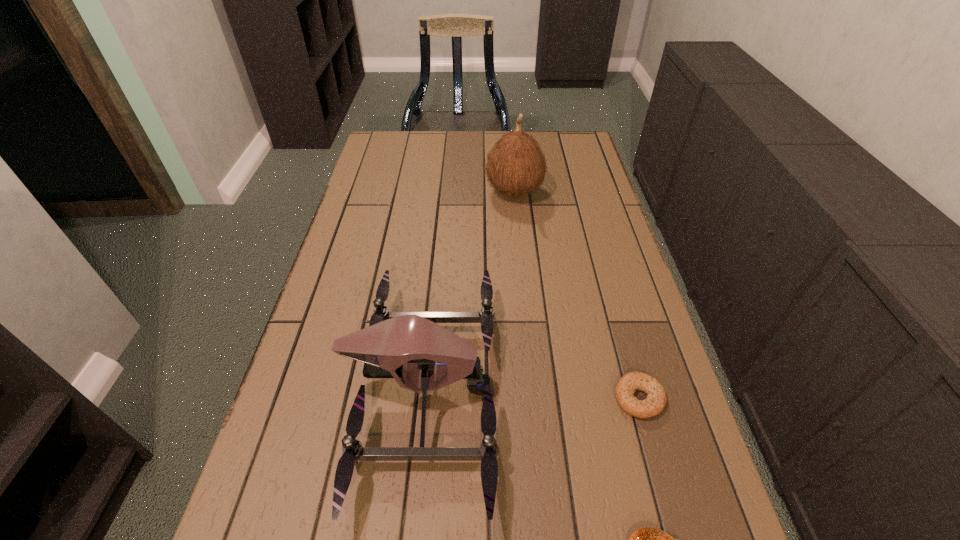
Identify which object is the third closest to the tallest object. Please provide its 2D coordinates. Your answer should be formatted as a tuple, i.e. [(x, y)], where the tuple contains the x and y coordinates of a point satisfying the conditions above.

[(646, 539)]

What are the coordinates of `object that ranks as the second closest to the shorter bagel` in the screenshot? It's located at (409, 345).

Locate an element on the screen. The height and width of the screenshot is (540, 960). free spot that satisfies the following two spatial constraints: 1. on the front-facing side of the farther bagel; 2. on the left side of the drone is located at coordinates (421, 398).

The height and width of the screenshot is (540, 960). I want to click on free spot that satisfies the following two spatial constraints: 1. on the surface of the farther bagel; 2. on the right side of the tallest object, so click(x=534, y=398).

Where is `vacant space that satisfies the following two spatial constraints: 1. on the front-facing side of the farther bagel; 2. on the right side of the third shortest object`? vacant space that satisfies the following two spatial constraints: 1. on the front-facing side of the farther bagel; 2. on the right side of the third shortest object is located at coordinates (421, 398).

At what (x,y) coordinates should I click in order to perform the action: click on vacant area in the image that satisfies the following two spatial constraints: 1. on the back side of the farther bagel; 2. on the front-facing side of the drone. Please return your answer as a coordinate pair (x, y). The width and height of the screenshot is (960, 540). Looking at the image, I should click on [636, 390].

Locate an element on the screen. vacant area in the image that satisfies the following two spatial constraints: 1. on the surface of the coconut; 2. on the left side of the farther bagel is located at coordinates (534, 398).

At what (x,y) coordinates should I click in order to perform the action: click on free region that satisfies the following two spatial constraints: 1. on the back side of the farther bagel; 2. on the surface of the tallest object. Please return your answer as a coordinate pair (x, y). Looking at the image, I should click on (581, 192).